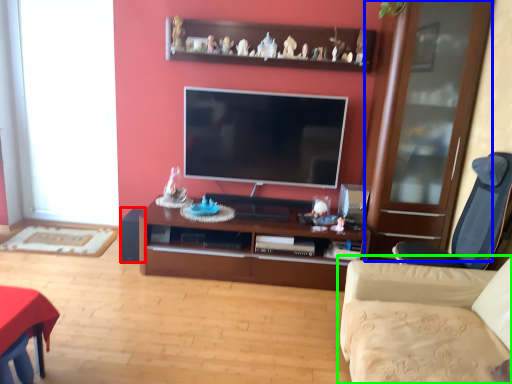
Question: Considering the real-world distances, which object is farthest from speaker (highlighted by a red box)? glass door (highlighted by a blue box) or studio couch (highlighted by a green box)?

Choices:
 (A) glass door
 (B) studio couch

Answer: (A)